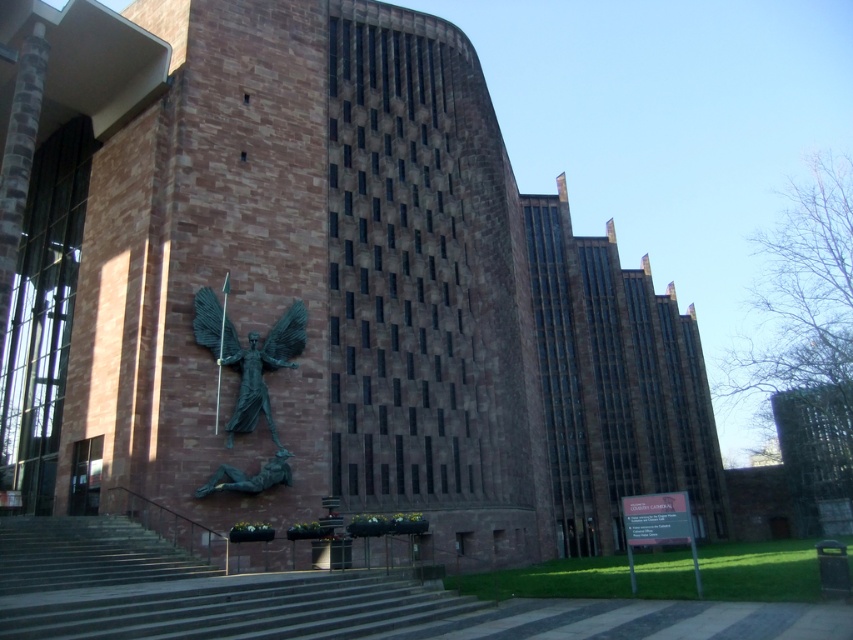
Question: Is bronze statue at center positioned at the back of bronze/statue at lower center?

Choices:
 (A) no
 (B) yes

Answer: (B)

Question: Which point is farther to the camera?

Choices:
 (A) (215, 480)
 (B) (207, 342)

Answer: (B)

Question: Which of the following is the farthest from the observer?

Choices:
 (A) bronze statue at center
 (B) bronze/statue at lower center

Answer: (A)

Question: Is bronze statue at center smaller than bronze/statue at lower center?

Choices:
 (A) yes
 (B) no

Answer: (B)

Question: Does bronze statue at center have a larger size compared to bronze/statue at lower center?

Choices:
 (A) yes
 (B) no

Answer: (A)